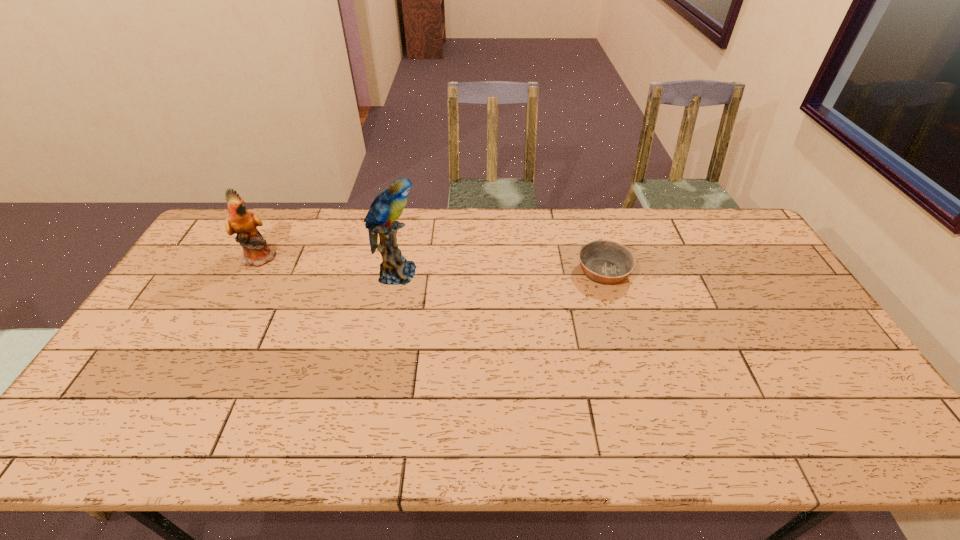
The width and height of the screenshot is (960, 540). Find the location of `vacant area that satisfies the following two spatial constraints: 1. on the front-facing side of the rightmost object; 2. on the left side of the left parrot`. vacant area that satisfies the following two spatial constraints: 1. on the front-facing side of the rightmost object; 2. on the left side of the left parrot is located at coordinates point(253,272).

Where is `vacant area in the image that satisfies the following two spatial constraints: 1. on the front side of the shortest object; 2. on the face of the right parrot`? This screenshot has width=960, height=540. vacant area in the image that satisfies the following two spatial constraints: 1. on the front side of the shortest object; 2. on the face of the right parrot is located at coordinates (604, 273).

Where is `free space that satisfies the following two spatial constraints: 1. on the front-facing side of the second tallest object; 2. on the right side of the bowl`? Image resolution: width=960 pixels, height=540 pixels. free space that satisfies the following two spatial constraints: 1. on the front-facing side of the second tallest object; 2. on the right side of the bowl is located at coordinates (253, 272).

Where is `blank space that satisfies the following two spatial constraints: 1. on the front-facing side of the leftmost object; 2. on the right side of the rightmost object`? This screenshot has width=960, height=540. blank space that satisfies the following two spatial constraints: 1. on the front-facing side of the leftmost object; 2. on the right side of the rightmost object is located at coordinates (253, 272).